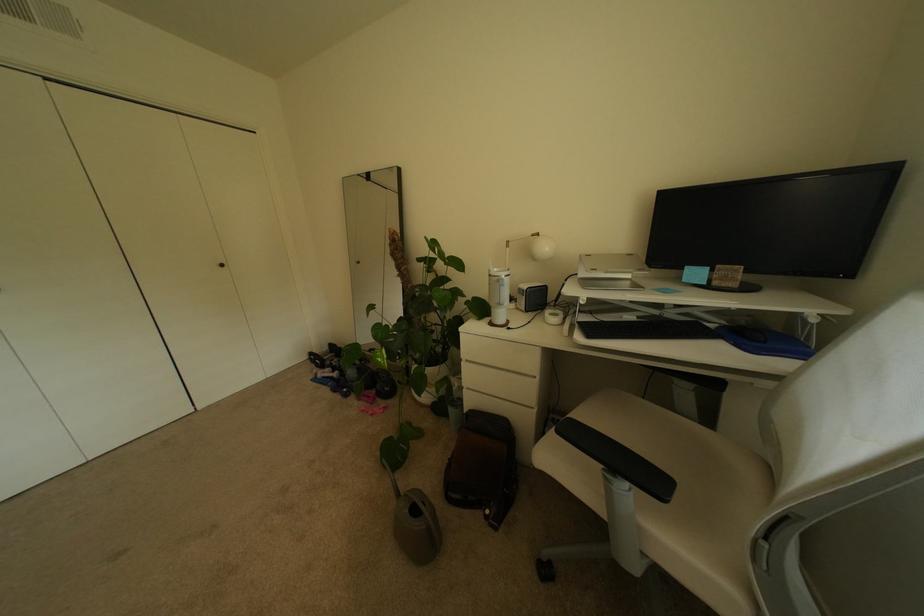
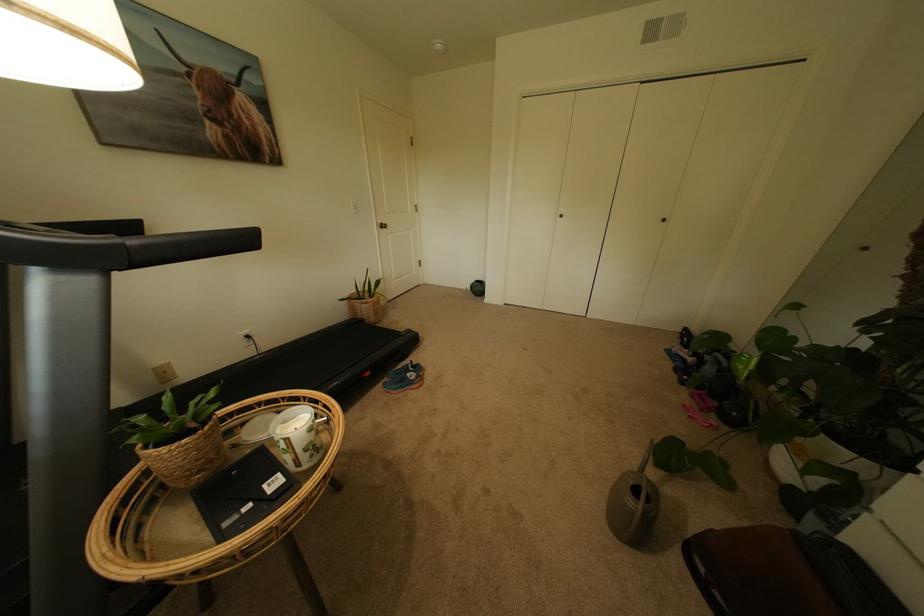
How did the camera likely rotate?

The rotation direction of the camera is left-down.